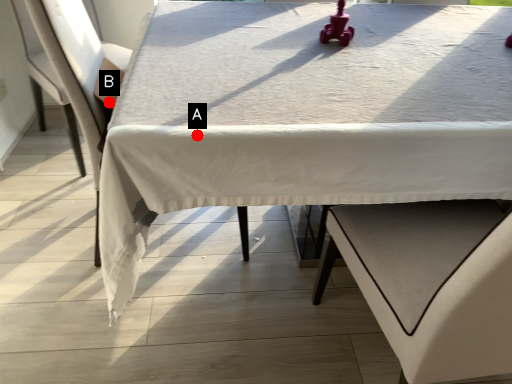
Question: Two points are circled on the image, labeled by A and B beside each circle. Which point is closer to the camera?

Choices:
 (A) A is closer
 (B) B is closer

Answer: (A)